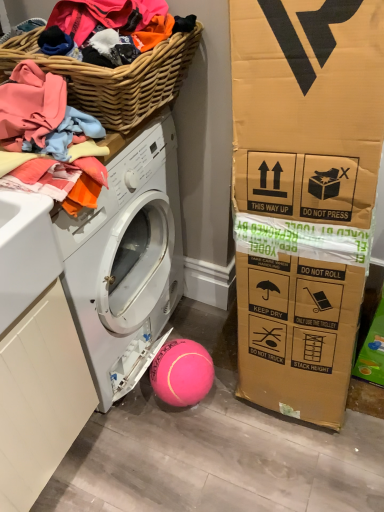
Question: From the image's perspective, is pink rubber ball at lower center under woven wood basket at upper left?

Choices:
 (A) no
 (B) yes

Answer: (B)

Question: Considering the relative positions of pink rubber ball at lower center and woven wood basket at upper left in the image provided, is pink rubber ball at lower center to the left of woven wood basket at upper left from the viewer's perspective?

Choices:
 (A) no
 (B) yes

Answer: (A)

Question: Is pink rubber ball at lower center positioned in front of woven wood basket at upper left?

Choices:
 (A) no
 (B) yes

Answer: (A)

Question: Does pink rubber ball at lower center have a larger size compared to woven wood basket at upper left?

Choices:
 (A) no
 (B) yes

Answer: (A)

Question: Is pink rubber ball at lower center wider than woven wood basket at upper left?

Choices:
 (A) yes
 (B) no

Answer: (B)

Question: Is pink rubber ball at lower center taller than woven wood basket at upper left?

Choices:
 (A) yes
 (B) no

Answer: (B)

Question: Is woven wood basket at upper left outside of white matte washing machine at lower left?

Choices:
 (A) no
 (B) yes

Answer: (B)

Question: Could you tell me if woven wood basket at upper left is facing white matte washing machine at lower left?

Choices:
 (A) no
 (B) yes

Answer: (A)

Question: Are woven wood basket at upper left and white matte washing machine at lower left beside each other?

Choices:
 (A) yes
 (B) no

Answer: (B)

Question: Are woven wood basket at upper left and white matte washing machine at lower left far apart?

Choices:
 (A) no
 (B) yes

Answer: (A)

Question: Is woven wood basket at upper left taller than white matte washing machine at lower left?

Choices:
 (A) no
 (B) yes

Answer: (A)

Question: Can you confirm if woven wood basket at upper left is smaller than white matte washing machine at lower left?

Choices:
 (A) yes
 (B) no

Answer: (A)

Question: Is pink rubber ball at lower center aimed at soft cotton clothes at upper left?

Choices:
 (A) yes
 (B) no

Answer: (B)